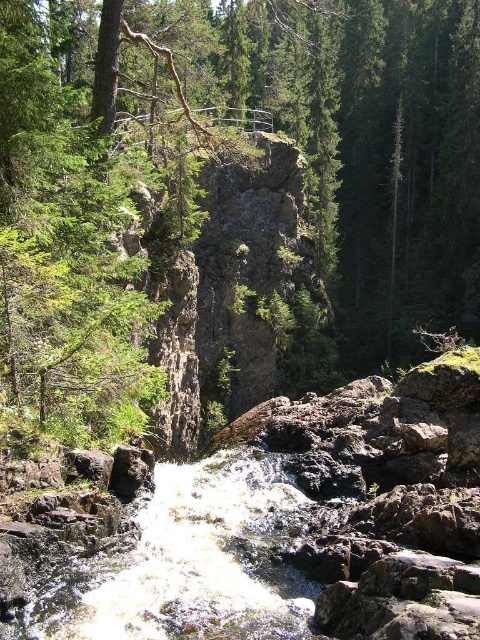
Can you confirm if green rough tree at center is wider than white frothy water at center?

Yes, green rough tree at center is wider than white frothy water at center.

Is green rough tree at center to the right of white frothy water at center from the viewer's perspective?

Indeed, green rough tree at center is positioned on the right side of white frothy water at center.

You are a GUI agent. You are given a task and a screenshot of the screen. Output one action in this format:
    pyautogui.click(x=<x>, y=<y>)
    Task: Click on the green rough tree at center
    
    Given the screenshot: What is the action you would take?
    pyautogui.click(x=233, y=193)